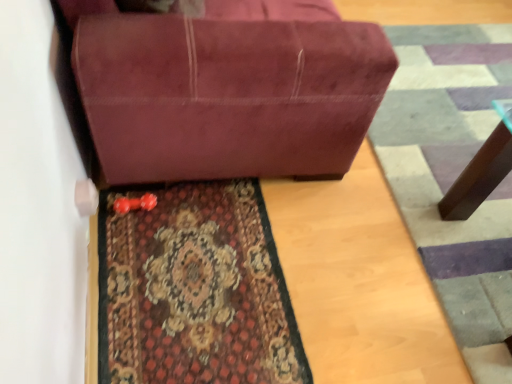
Where is `vacant area located to the right-hand side of suede-like maroon couch at center`? This screenshot has height=384, width=512. vacant area located to the right-hand side of suede-like maroon couch at center is located at coordinates (440, 155).